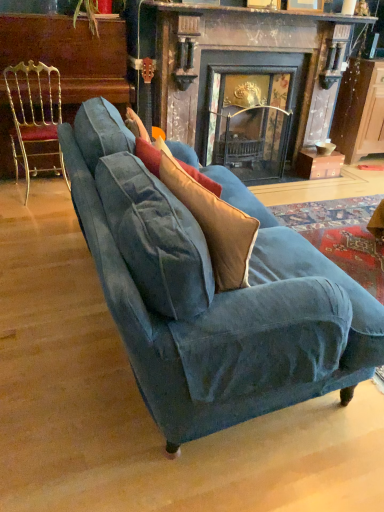
Question: From the image's perspective, is gold metallic chair at left beneath velvet blue couch at center?

Choices:
 (A) no
 (B) yes

Answer: (A)

Question: Is gold metallic chair at left outside of velvet blue couch at center?

Choices:
 (A) no
 (B) yes

Answer: (B)

Question: Considering the relative positions of gold metallic chair at left and velvet blue couch at center in the image provided, is gold metallic chair at left in front of velvet blue couch at center?

Choices:
 (A) yes
 (B) no

Answer: (B)

Question: Is gold metallic chair at left wider than velvet blue couch at center?

Choices:
 (A) no
 (B) yes

Answer: (A)

Question: Does gold metallic chair at left have a lesser width compared to velvet blue couch at center?

Choices:
 (A) yes
 (B) no

Answer: (A)

Question: Is point (177, 182) positioned closer to the camera than point (109, 105)?

Choices:
 (A) closer
 (B) farther

Answer: (A)

Question: Based on their positions, is velvet beige throw pillow at center located to the left or right of velvet blue couch at center?

Choices:
 (A) right
 (B) left

Answer: (B)

Question: From a real-world perspective, is velvet beige throw pillow at center above or below velvet blue couch at center?

Choices:
 (A) below
 (B) above

Answer: (B)

Question: Is velvet beige throw pillow at center spatially inside velvet blue couch at center, or outside of it?

Choices:
 (A) inside
 (B) outside

Answer: (A)

Question: Considering the positions of point (382, 106) and point (205, 318), is point (382, 106) closer or farther from the camera than point (205, 318)?

Choices:
 (A) closer
 (B) farther

Answer: (B)

Question: In the image, is wooden cabinet at right positioned in front of or behind velvet blue couch at center?

Choices:
 (A) front
 (B) behind

Answer: (B)

Question: Considering the positions of wooden cabinet at right and velvet blue couch at center in the image, is wooden cabinet at right wider or thinner than velvet blue couch at center?

Choices:
 (A) wide
 (B) thin

Answer: (B)

Question: Visually, is wooden cabinet at right positioned to the left or to the right of velvet blue couch at center?

Choices:
 (A) left
 (B) right

Answer: (B)

Question: In the image, is velvet blue couch at center positioned in front of or behind dark wood fireplace at center?

Choices:
 (A) behind
 (B) front

Answer: (B)

Question: Choose the correct answer: Is velvet blue couch at center inside dark wood fireplace at center or outside it?

Choices:
 (A) inside
 (B) outside

Answer: (B)